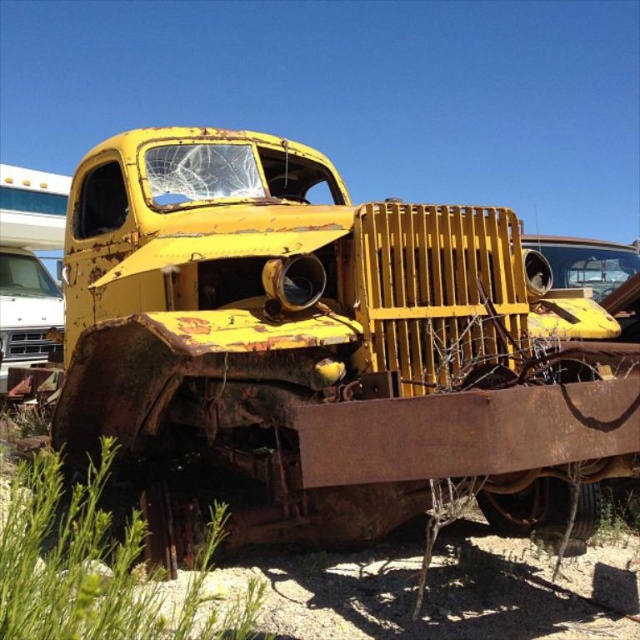
Does green leafy grass at lower left have a lesser height compared to rusty metal truck at center?

In fact, green leafy grass at lower left may be taller than rusty metal truck at center.

Between point (83, 552) and point (612, 260), which one is positioned in front?

Point (83, 552) is more forward.

Where is `green leafy grass at lower left`? The height and width of the screenshot is (640, 640). green leafy grass at lower left is located at coordinates (100, 566).

Is rusty yellow truck at center below rusty metal truck at center?

Correct, rusty yellow truck at center is located below rusty metal truck at center.

From the picture: Who is taller, rusty yellow truck at center or rusty metal truck at center?

With more height is rusty yellow truck at center.

What do you see at coordinates (330, 342) in the screenshot?
I see `rusty yellow truck at center` at bounding box center [330, 342].

The width and height of the screenshot is (640, 640). Find the location of `rusty yellow truck at center`. rusty yellow truck at center is located at coordinates (330, 342).

What do you see at coordinates (330, 342) in the screenshot? I see `rusty yellow truck at center` at bounding box center [330, 342].

This screenshot has width=640, height=640. What do you see at coordinates (330, 342) in the screenshot?
I see `rusty yellow truck at center` at bounding box center [330, 342].

Find the location of a particular element. The image size is (640, 640). rusty yellow truck at center is located at coordinates (330, 342).